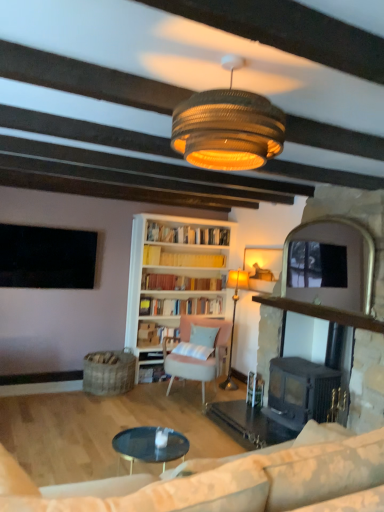
Find the location of a particular element. The width and height of the screenshot is (384, 512). vacant location below matte gold lamp at center, which is the first lamp from back to front (from a real-world perspective) is located at coordinates (229, 388).